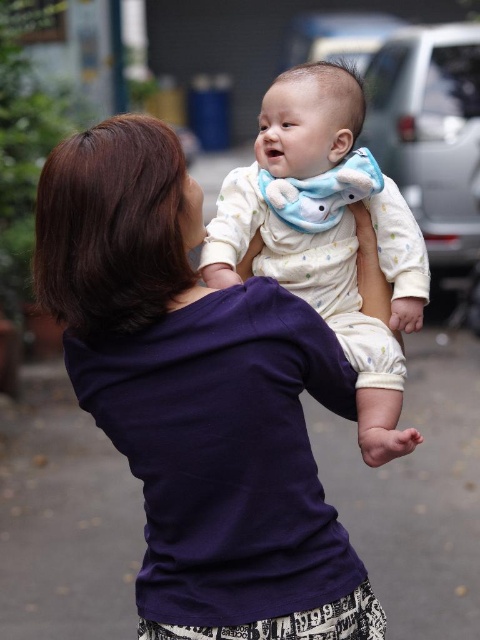
Can you confirm if purple cotton shirt at center is thinner than white dotted fabric at center?

No.

Is purple cotton shirt at center to the right of white dotted fabric at center from the viewer's perspective?

In fact, purple cotton shirt at center is to the left of white dotted fabric at center.

Which is in front, point (301, 525) or point (344, 324)?

Point (301, 525) is in front.

Identify the location of purple cotton shirt at center. This screenshot has width=480, height=640. (197, 397).